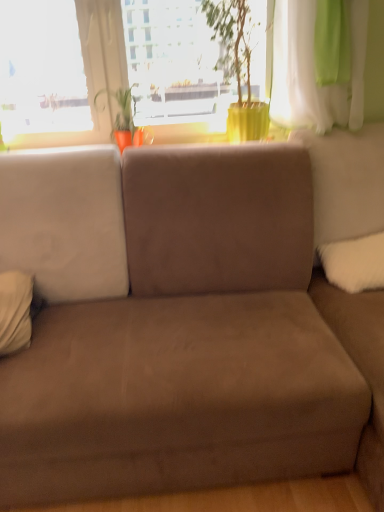
Question: Is matte orange pot at center turned away from green matte plant pot at upper center?

Choices:
 (A) no
 (B) yes

Answer: (A)

Question: Does matte orange pot at center touch green matte plant pot at upper center?

Choices:
 (A) no
 (B) yes

Answer: (A)

Question: Is matte orange pot at center behind green matte plant pot at upper center?

Choices:
 (A) yes
 (B) no

Answer: (A)

Question: Are matte orange pot at center and green matte plant pot at upper center far apart?

Choices:
 (A) no
 (B) yes

Answer: (A)

Question: Is matte orange pot at center wider than green matte plant pot at upper center?

Choices:
 (A) no
 (B) yes

Answer: (A)

Question: In the image, is transparent glass window at upper center positioned in front of or behind green matte plant pot at upper center?

Choices:
 (A) front
 (B) behind

Answer: (B)

Question: Considering the positions of transparent glass window at upper center and green matte plant pot at upper center in the image, is transparent glass window at upper center bigger or smaller than green matte plant pot at upper center?

Choices:
 (A) big
 (B) small

Answer: (A)

Question: From the image's perspective, is transparent glass window at upper center positioned above or below green matte plant pot at upper center?

Choices:
 (A) below
 (B) above

Answer: (B)

Question: Is transparent glass window at upper center spatially inside green matte plant pot at upper center, or outside of it?

Choices:
 (A) inside
 (B) outside

Answer: (B)

Question: Does point (11, 308) appear closer or farther from the camera than point (379, 236)?

Choices:
 (A) farther
 (B) closer

Answer: (B)

Question: From the image's perspective, is white soft pillow at left, which is counted as the second pillow, starting from the right, positioned above or below white fluffy pillow at right, acting as the 2th pillow starting from the left?

Choices:
 (A) above
 (B) below

Answer: (B)

Question: Do you think white soft pillow at left, which appears as the first pillow when viewed from the left, is within white fluffy pillow at right, the first pillow positioned from the right, or outside of it?

Choices:
 (A) inside
 (B) outside

Answer: (B)

Question: Is white soft pillow at left, which is counted as the second pillow, starting from the right, in front of or behind white fluffy pillow at right, acting as the 2th pillow starting from the left, in the image?

Choices:
 (A) front
 (B) behind

Answer: (A)

Question: Considering the positions of green matte plant pot at upper center and white soft pillow at left, which appears as the first pillow when viewed from the left, in the image, is green matte plant pot at upper center taller or shorter than white soft pillow at left, which appears as the first pillow when viewed from the left,?

Choices:
 (A) short
 (B) tall

Answer: (B)

Question: Does point pyautogui.click(x=183, y=89) appear closer or farther from the camera than point pyautogui.click(x=14, y=309)?

Choices:
 (A) farther
 (B) closer

Answer: (A)